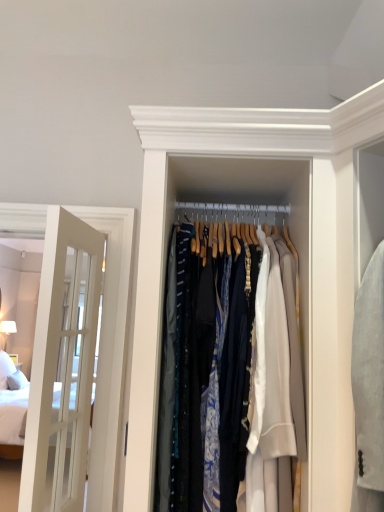
Question: In terms of width, does silky fabric clothes at center look wider or thinner when compared to white glass door at left?

Choices:
 (A) wide
 (B) thin

Answer: (A)

Question: Would you say silky fabric clothes at center is to the left or to the right of white glass door at left in the picture?

Choices:
 (A) left
 (B) right

Answer: (B)

Question: Is silky fabric clothes at center taller or shorter than white glass door at left?

Choices:
 (A) short
 (B) tall

Answer: (A)

Question: Considering their positions, is white glass door at left located in front of or behind silky fabric clothes at center?

Choices:
 (A) front
 (B) behind

Answer: (B)

Question: Looking at their shapes, would you say white glass door at left is wider or thinner than silky fabric clothes at center?

Choices:
 (A) wide
 (B) thin

Answer: (B)

Question: Based on their sizes in the image, would you say white glass door at left is bigger or smaller than silky fabric clothes at center?

Choices:
 (A) big
 (B) small

Answer: (B)

Question: From the image's perspective, is white glass door at left positioned above or below silky fabric clothes at center?

Choices:
 (A) below
 (B) above

Answer: (A)